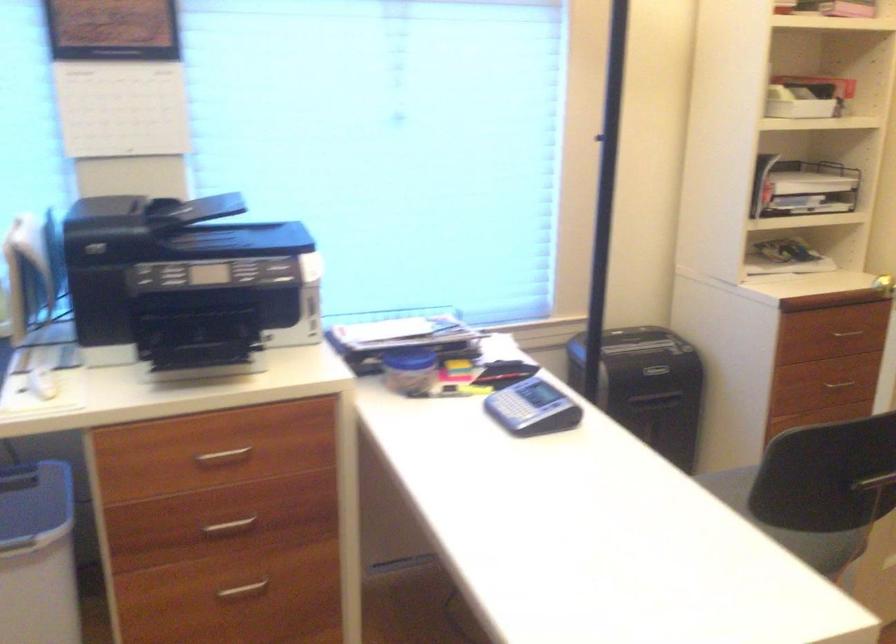
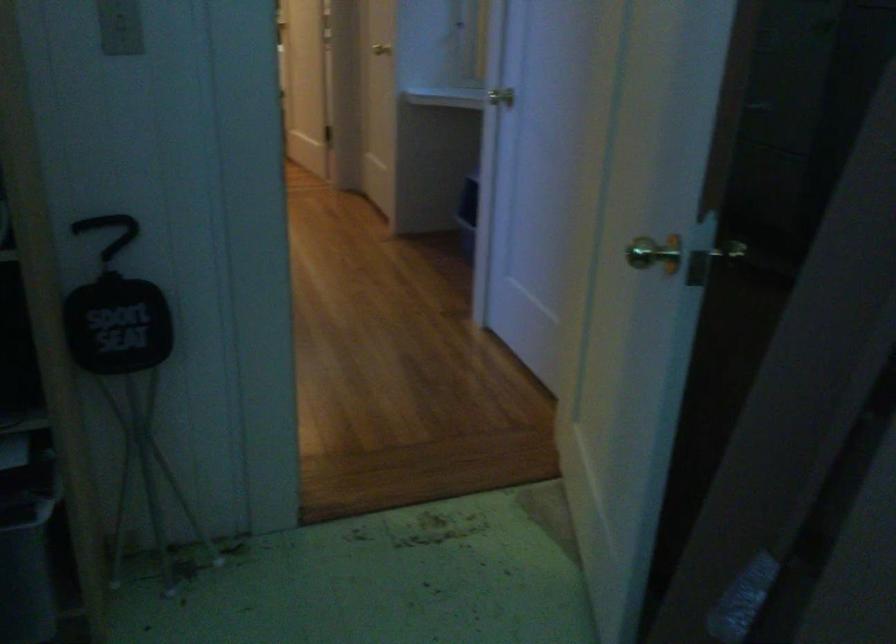
Question: I am providing you with two images of the same scene from different viewpoints. After the viewpoint changes to image2, which objects are now occluded?

Choices:
 (A) shredder bin
 (B) brass door handle
 (C) light switch
 (D) gray shoe

Answer: (A)